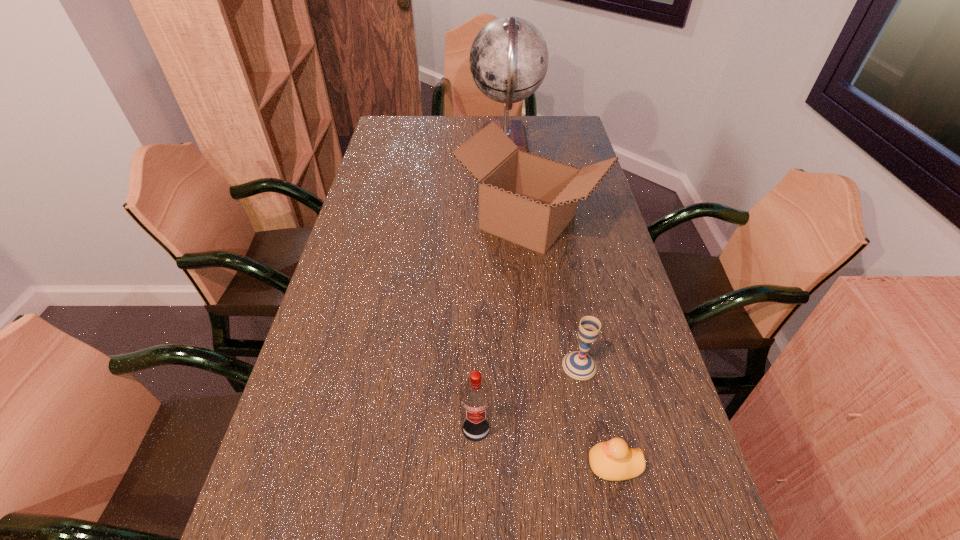
This screenshot has width=960, height=540. In order to click on free spot between the vodka and the globe in this screenshot , I will do `click(491, 286)`.

At what (x,y) coordinates should I click in order to perform the action: click on free space between the fourth shortest object and the third shortest object. Please return your answer as a coordinate pair (x, y). Looking at the image, I should click on (502, 326).

Locate an element on the screen. This screenshot has height=540, width=960. vacant region between the vodka and the second tallest object is located at coordinates (502, 326).

Where is `free space between the shortest object and the second farthest object`? The image size is (960, 540). free space between the shortest object and the second farthest object is located at coordinates (571, 343).

Locate an element on the screen. vacant point located between the fourth farthest object and the second tallest object is located at coordinates (502, 326).

At what (x,y) coordinates should I click in order to perform the action: click on object that stands as the closest to the farthest object. Please return your answer as a coordinate pair (x, y). The width and height of the screenshot is (960, 540). Looking at the image, I should click on (529, 200).

Choose which object is the fourth nearest neighbor to the tallest object. Please provide its 2D coordinates. Your answer should be formatted as a tuple, i.e. [(x, y)], where the tuple contains the x and y coordinates of a point satisfying the conditions above.

[(613, 460)]

The image size is (960, 540). I want to click on blank area in the image that satisfies the following two spatial constraints: 1. on the back side of the chalice; 2. at the equator of the globe, so click(x=538, y=143).

The width and height of the screenshot is (960, 540). Find the location of `free location that satisfies the following two spatial constraints: 1. at the equator of the farthest object; 2. on the back side of the third nearest object`. free location that satisfies the following two spatial constraints: 1. at the equator of the farthest object; 2. on the back side of the third nearest object is located at coordinates (524, 366).

You are a GUI agent. You are given a task and a screenshot of the screen. Output one action in this format:
    pyautogui.click(x=<x>, y=<y>)
    Task: Click on the vacant point that satisfies the following two spatial constraints: 1. at the equator of the globe; 2. on the front label of the second nearest object
    This screenshot has width=960, height=540.
    Given the screenshot: What is the action you would take?
    pyautogui.click(x=529, y=429)